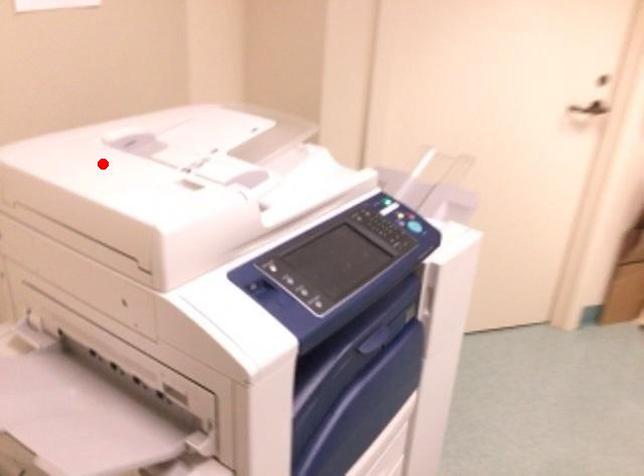
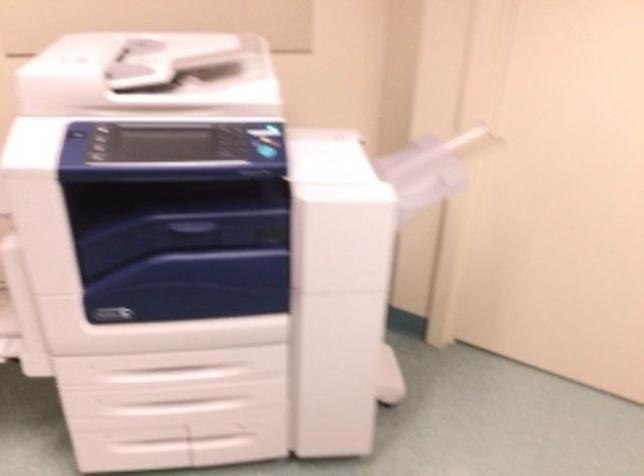
Locate, in the second image, the point that corresponds to the highlighted location in the first image.

(122, 54)